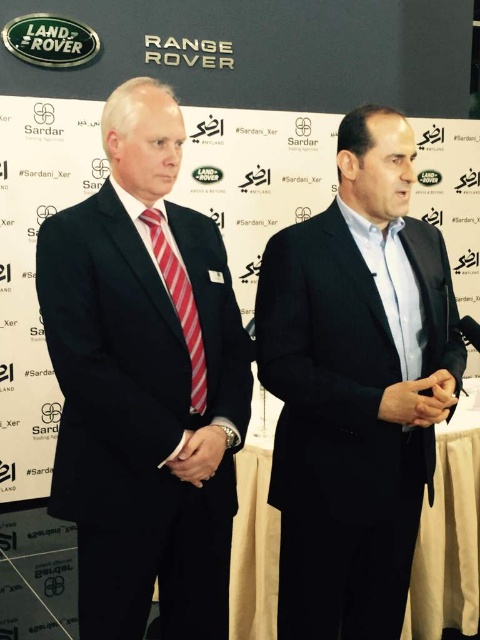
Is black matte suit at left positioned before red striped tie at center?

Yes.

Is point (139, 369) behind point (191, 296)?

No, (139, 369) is in front of (191, 296).

Is point (250, 339) positioned behind point (171, 273)?

Yes.

This screenshot has width=480, height=640. I want to click on black matte suit at left, so click(144, 384).

How much distance is there between black matte suit at center and red striped tie at center?

A distance of 18.28 inches exists between black matte suit at center and red striped tie at center.

Can you confirm if black matte suit at center is positioned above red striped tie at center?

Actually, black matte suit at center is below red striped tie at center.

Does point (331, 492) come farther from viewer compared to point (152, 248)?

Yes, it is behind point (152, 248).

Where is `black matte suit at center`? The width and height of the screenshot is (480, 640). black matte suit at center is located at coordinates (356, 387).

This screenshot has height=640, width=480. Find the location of `black matte suit at left`. black matte suit at left is located at coordinates (144, 384).

Does black matte suit at left lie behind black matte suit at center?

No, it is not.

Does point (222, 353) come farther from viewer compared to point (411, 529)?

No, it is in front of (411, 529).

This screenshot has height=640, width=480. Identify the location of black matte suit at left. (144, 384).